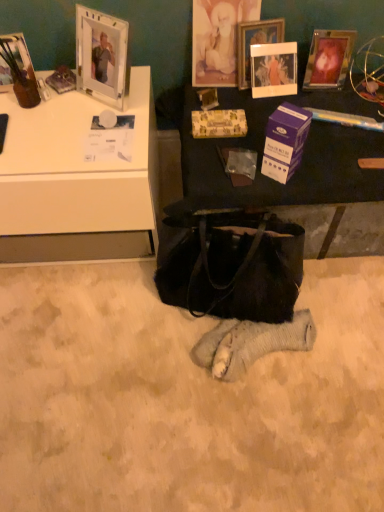
Where is `free spot in front of black leather handbag at center`? free spot in front of black leather handbag at center is located at coordinates (225, 414).